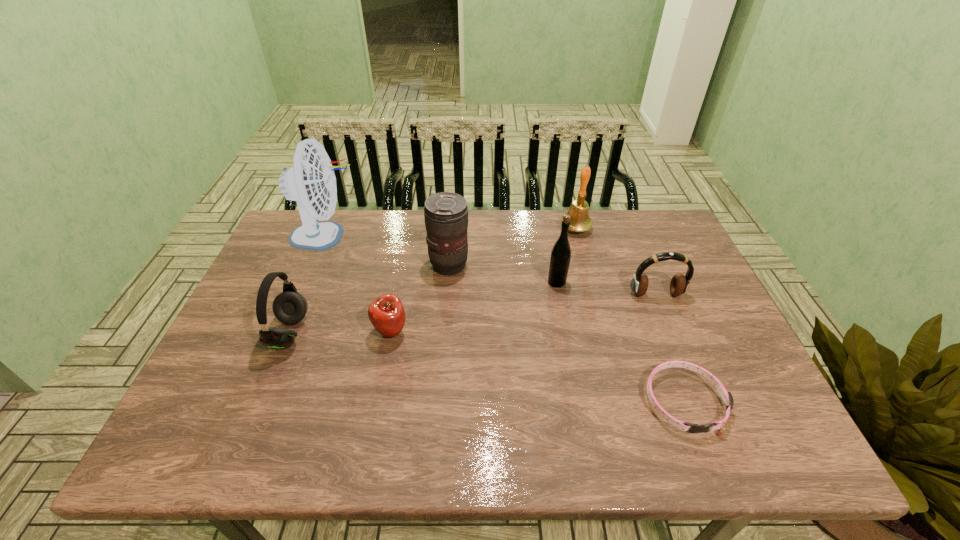
I want to click on the tallest object, so click(x=311, y=181).

At what (x,y) coordinates should I click in order to perform the action: click on the third object from right to left. Please return your answer as a coordinate pair (x, y). This screenshot has width=960, height=540. Looking at the image, I should click on (580, 221).

Identify the location of the fourth object from right to left. This screenshot has height=540, width=960. (560, 258).

Locate an element on the screen. telephoto lens is located at coordinates tap(446, 214).

The image size is (960, 540). What are the coordinates of `the left headset` in the screenshot? It's located at (289, 307).

Image resolution: width=960 pixels, height=540 pixels. In order to click on the fifth tallest object in this screenshot , I will do `click(289, 307)`.

The height and width of the screenshot is (540, 960). In order to click on the right headset in this screenshot , I will do `click(679, 284)`.

The width and height of the screenshot is (960, 540). What are the coordinates of `the farther headset` in the screenshot? It's located at (679, 284).

Identify the location of the third object from left to right. The image size is (960, 540). (386, 313).

Where is `apple`? This screenshot has height=540, width=960. apple is located at coordinates (386, 313).